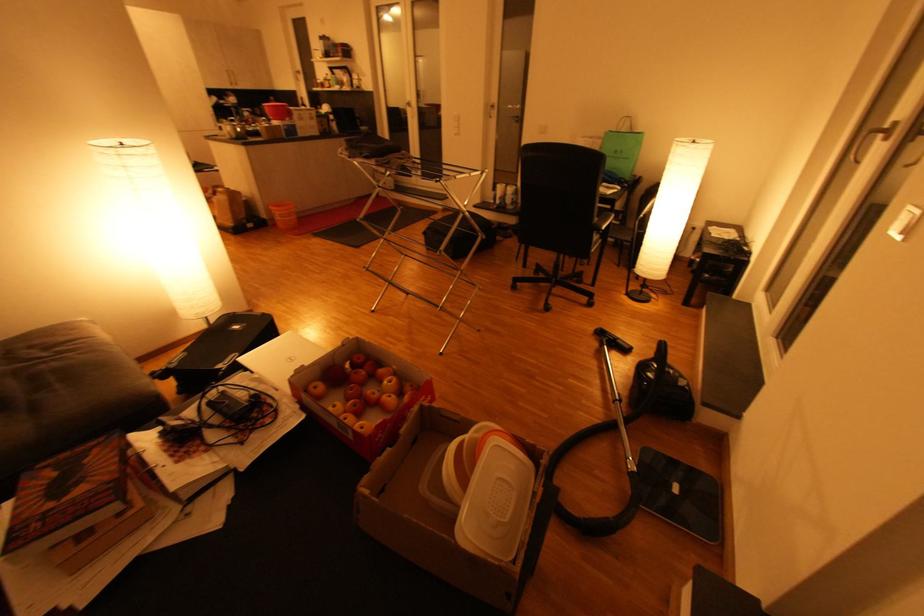
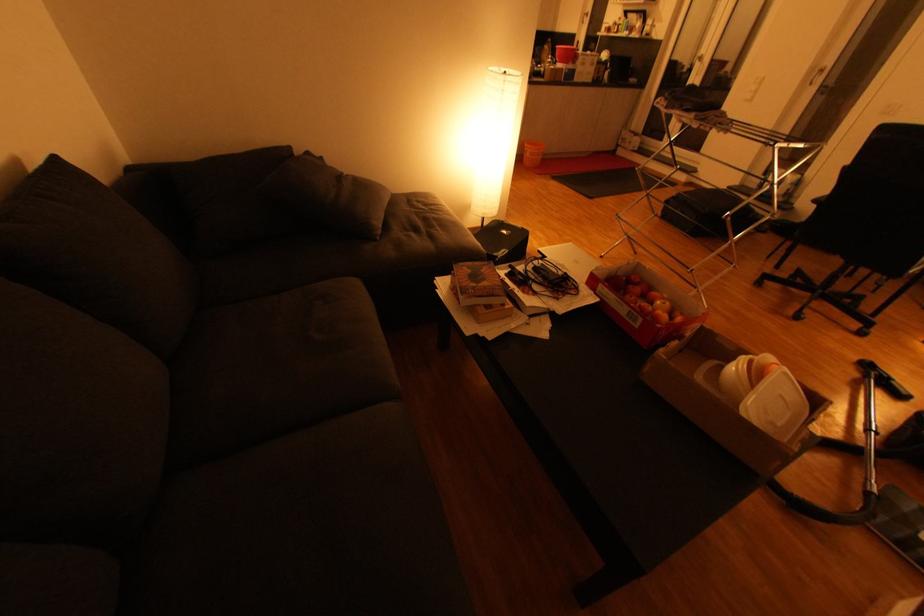
Question: The camera is either moving clockwise (left) or counter-clockwise (right) around the object. The first image is from the beginning of the video and the second image is from the end. Is the camera moving left or right when shooting the video?

Choices:
 (A) Left
 (B) Right

Answer: (B)